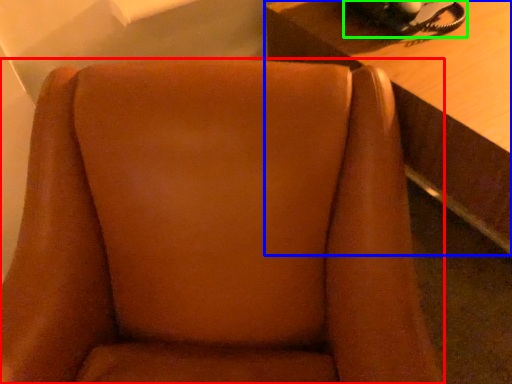
Question: Which object is the closest to the chair (highlighted by a red box)? Choose among these: table (highlighted by a blue box) or corded phone (highlighted by a green box).

Choices:
 (A) table
 (B) corded phone

Answer: (A)